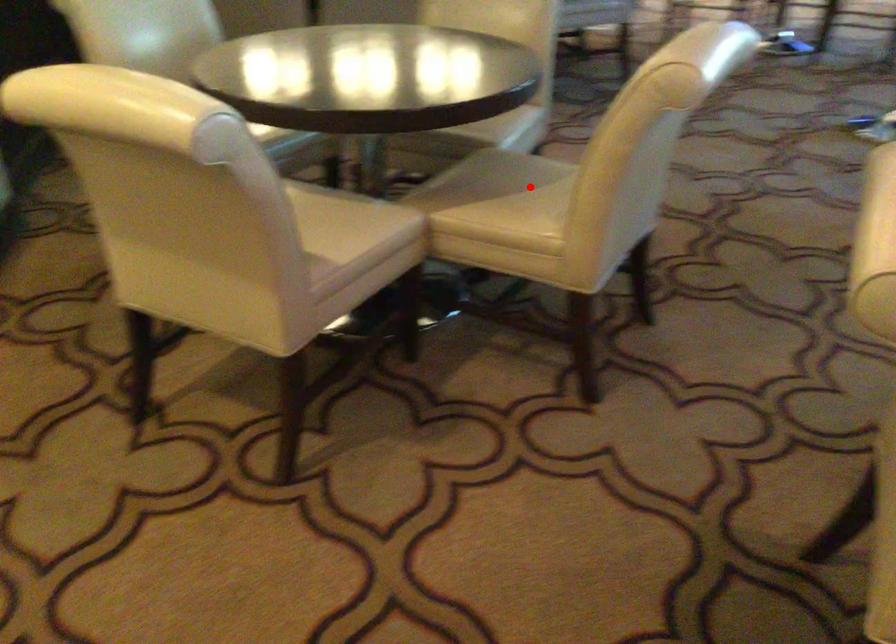
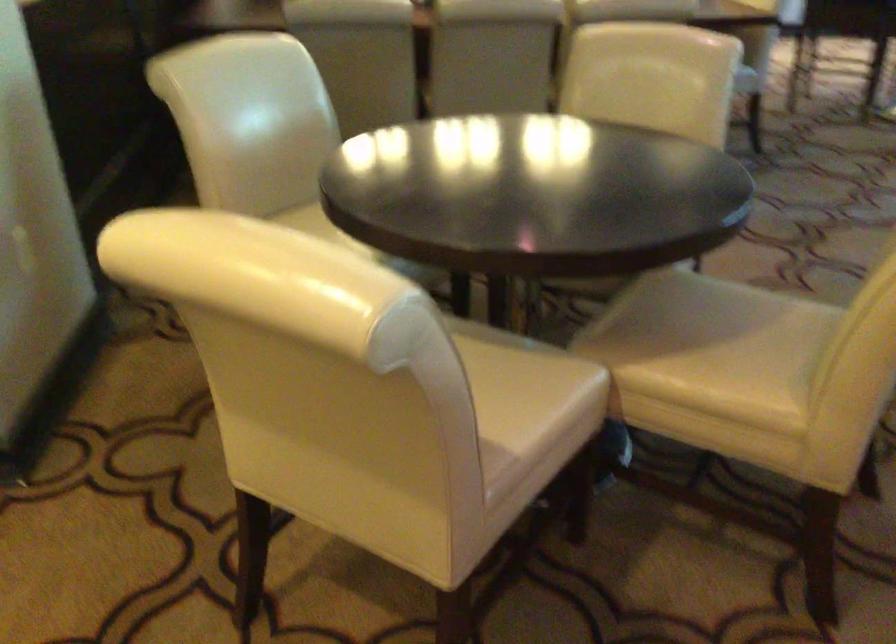
Question: I am providing you with two images of the same scene from different viewpoints. In image1, a red point is highlighted. Considering the same 3D point in image2, which of the following is correct?

Choices:
 (A) It is closer
 (B) It is farther

Answer: (A)